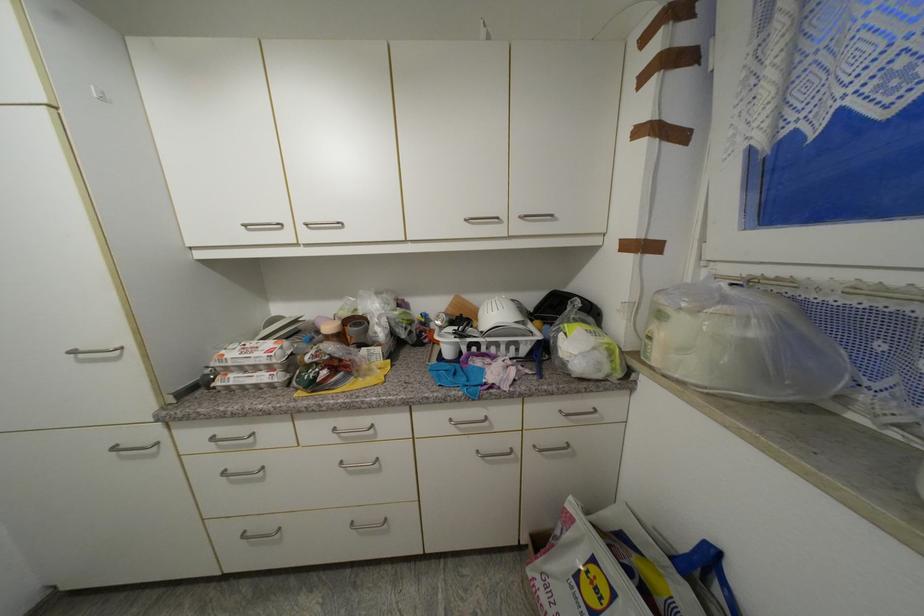
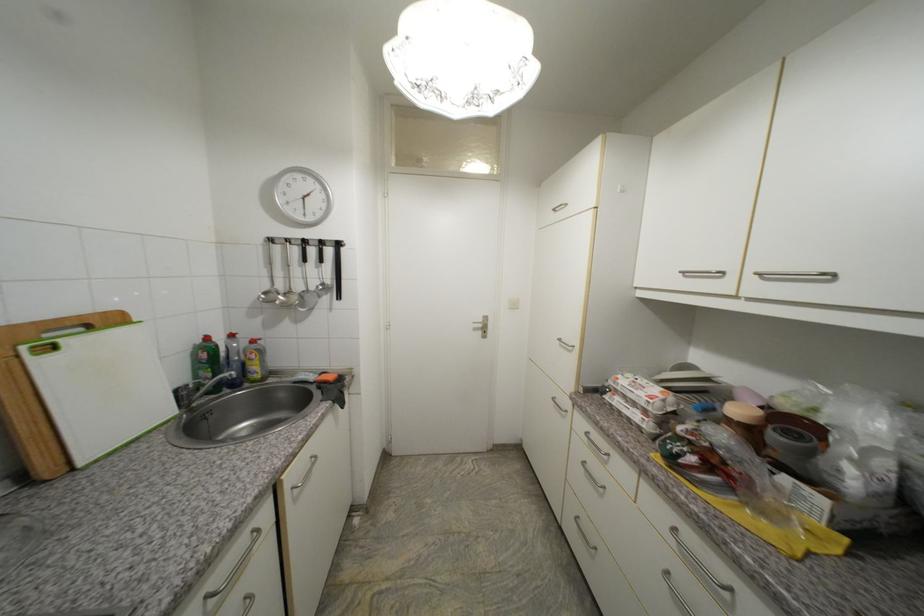
Locate, in the second image, the point that corresponds to pixel 345 338 in the first image.

(756, 432)